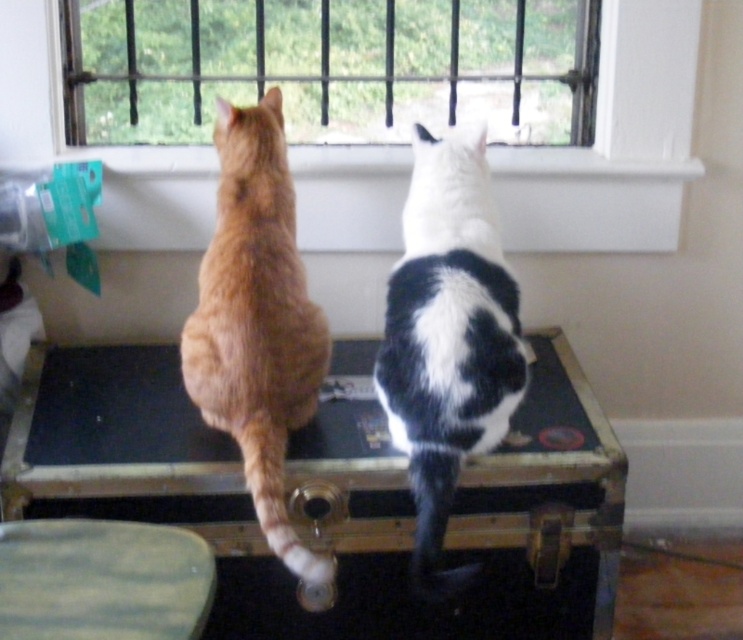
Between clear glass window at upper center and black-and-white fur cat at center, which one has less height?

clear glass window at upper center is shorter.

Who is positioned more to the left, clear glass window at upper center or black-and-white fur cat at center?

From the viewer's perspective, clear glass window at upper center appears more on the left side.

Between point (386, 4) and point (476, 252), which one is positioned in front?

Point (476, 252) is in front.

The width and height of the screenshot is (743, 640). I want to click on clear glass window at upper center, so click(x=330, y=67).

Can you confirm if clear glass window at upper center is thinner than orange fur cat at center?

No, clear glass window at upper center is not thinner than orange fur cat at center.

Does point (97, 90) come in front of point (210, 365)?

That is False.

Where is `clear glass window at upper center`? clear glass window at upper center is located at coordinates (330, 67).

Measure the distance between point (426, 406) and camera.

The distance of point (426, 406) from camera is 1.29 meters.

Who is positioned more to the left, black-and-white fur cat at center or orange fur cat at center?

From the viewer's perspective, orange fur cat at center appears more on the left side.

Does point (507, 300) lie behind point (282, 493)?

Yes, point (507, 300) is behind point (282, 493).

At what (x,y) coordinates should I click in order to perform the action: click on black-and-white fur cat at center. Please return your answer as a coordinate pair (x, y). This screenshot has height=640, width=743. Looking at the image, I should click on (447, 340).